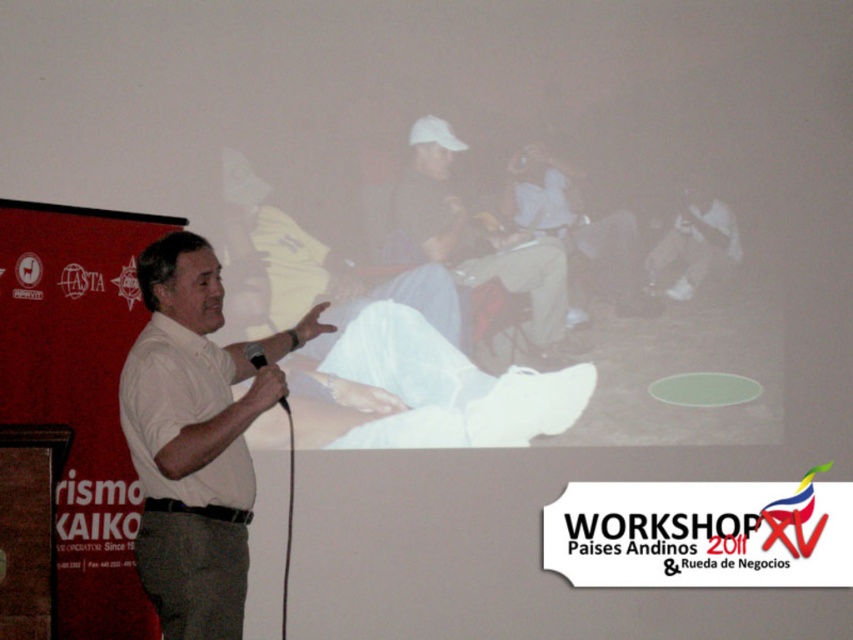
You are a photographer trying to capture a clear shot of both the matte white shirt at center and the black matte microphone at center. Which object should you focus on first to ensure both are in focus?

You should focus on the matte white shirt at center first since it is closer to you than the black matte microphone at center, ensuring both will be in focus if you set the focus on the closer object.

You are standing in the workshop and want to move from point A to point B. Point A is at coordinate point (125, 408) and point B is at coordinate point (230, 205). Which point is closer to you when you first arrive?

Point A at coordinate point (125, 408) is closer to you than point B at coordinate point (230, 205).